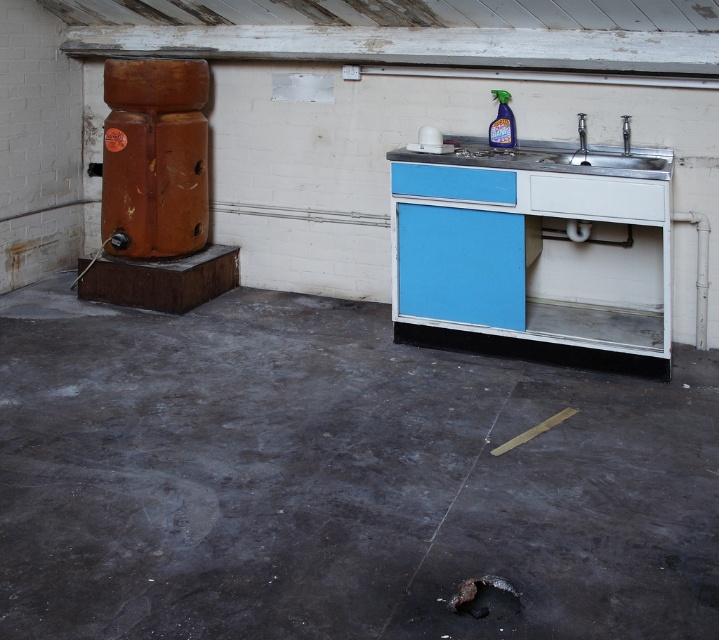
You are standing in the utility room and want to place a small tool on the floor. You have two options for placement points marked as point 1 at coordinates point (531, 166) and point 2 at coordinates point (582, 124). Which point is closer to you and thus safer to reach without moving closer?

Point (531, 166) is closer to the viewer than point (582, 124), so placing the tool there would be safer as it is easier to reach without moving closer.